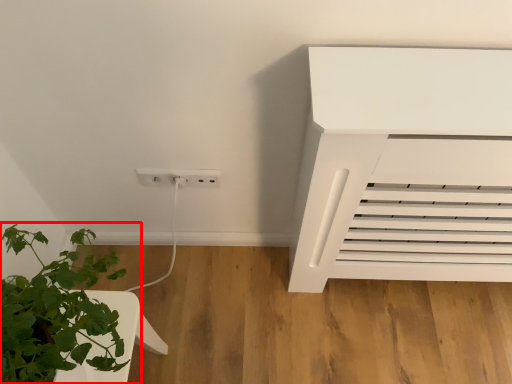
Question: From the image, what is the correct spatial relationship of houseplant (annotated by the red box) in relation to electric outlet?

Choices:
 (A) left
 (B) right

Answer: (A)